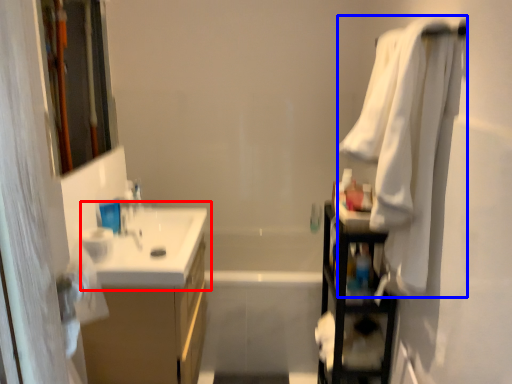
Question: Which object is closer to the camera taking this photo, sink (highlighted by a red box) or bath towel (highlighted by a blue box)?

Choices:
 (A) sink
 (B) bath towel

Answer: (B)